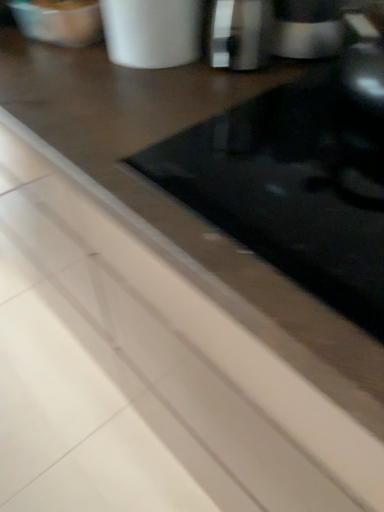
The width and height of the screenshot is (384, 512). In order to click on free space in front of sleek silver coffee machine at upper right in this screenshot , I will do `click(280, 91)`.